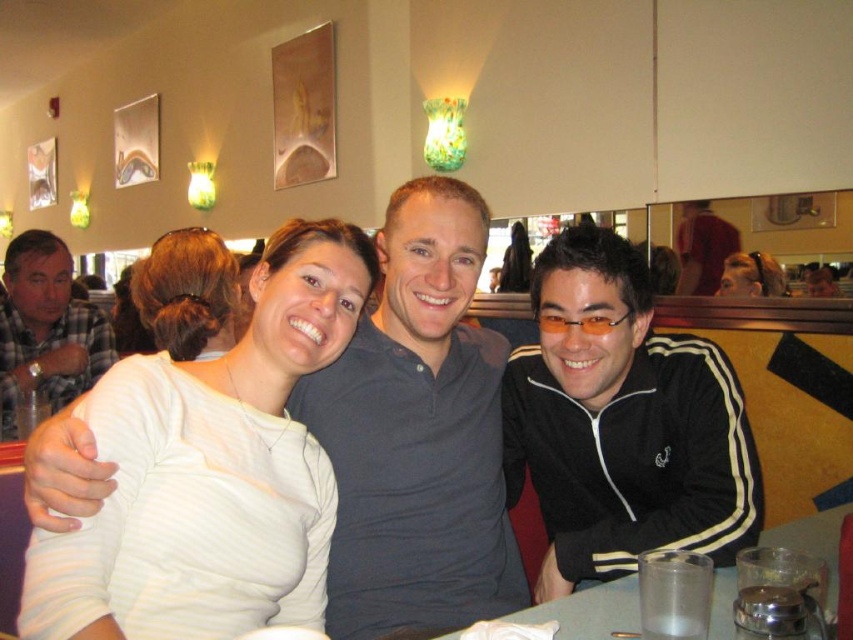
You are a photographer trying to capture a closeup of the blonde hair bun at center and the clear plastic cup at lower center. Which object should you zoom in on to ensure it appears larger in the photo?

The clear plastic cup at lower center is larger than the blonde hair bun at center, so you should zoom in on the clear plastic cup at lower center to make it appear larger in the photo.

You are a photographer standing at the back of the diner. You want to take a photo of the white matte shirt at center and the blonde hair bun at center so that both are clearly visible in the frame. Given their distance apart, is it possible to capture both in a single shot without zooming in?

The white matte shirt at center and blonde hair bun at center are 39.27 inches apart. Since the distance between them is about 39.27 inches, it is likely possible to capture both in a single shot without zooming in, as most camera lenses can accommodate this distance within a standard frame.

You are a photographer trying to capture a group photo of the plaid shirt at left and the blonde hair at upper right. Since you want to ensure both subjects are clearly visible, which one should you focus on first to account for their size difference?

The plaid shirt at left is bigger than the blonde hair at upper right, so you should focus on the plaid shirt at left first to ensure its details are sharp before adjusting for the smaller subject.